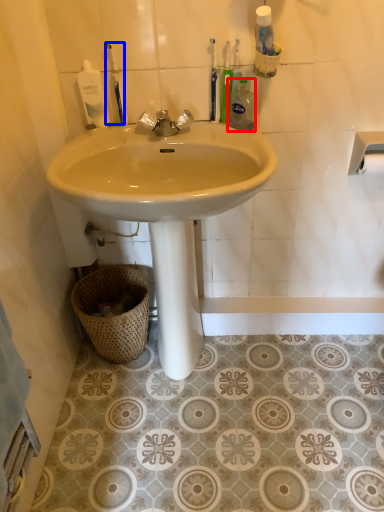
Question: Among these objects, which one is farthest to the camera, cleaning product (highlighted by a red box) or toothbrush (highlighted by a blue box)?

Choices:
 (A) cleaning product
 (B) toothbrush

Answer: (B)